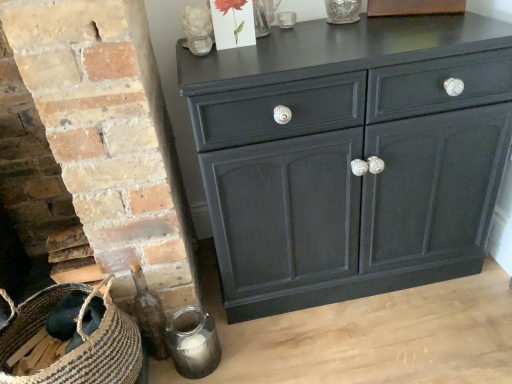
Find the location of `unoccupied area in front of matte paper card at upper center, the first flower from the right`. unoccupied area in front of matte paper card at upper center, the first flower from the right is located at coordinates (275, 63).